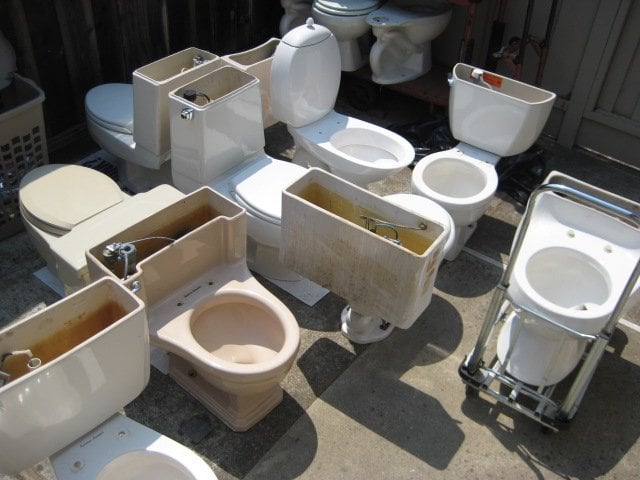
Identify the location of toilet tank. (354, 250), (80, 370).